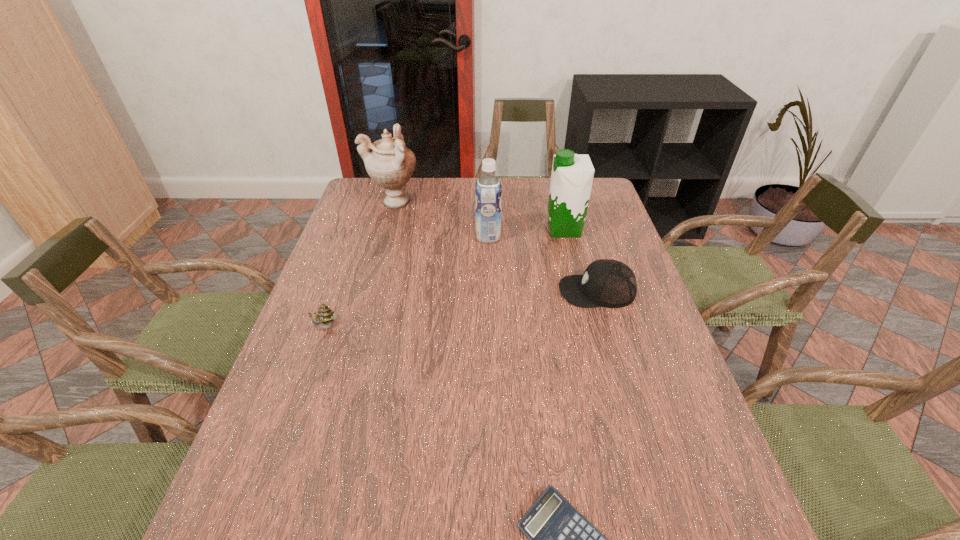
The width and height of the screenshot is (960, 540). What are the coordinates of `urn` in the screenshot? It's located at (390, 164).

Where is `the right soya milk`? This screenshot has width=960, height=540. the right soya milk is located at coordinates (572, 175).

This screenshot has height=540, width=960. I want to click on the left soya milk, so click(x=488, y=189).

Identify the location of the third nearest object. The width and height of the screenshot is (960, 540). (608, 283).

Find the location of a particular element. This screenshot has width=960, height=540. snail is located at coordinates (325, 315).

Where is `vacant space located 0.280m on the right of the urn`? vacant space located 0.280m on the right of the urn is located at coordinates (498, 201).

This screenshot has height=540, width=960. In order to click on vacant space located 0.230m on the front-facing side of the right soya milk in this screenshot , I will do `click(476, 230)`.

Image resolution: width=960 pixels, height=540 pixels. In order to click on blank space located 0.340m on the front-facing side of the right soya milk in this screenshot , I will do click(443, 230).

Find the location of `free spot located on the front-facing side of the right soya milk`. free spot located on the front-facing side of the right soya milk is located at coordinates (513, 230).

Locate an element on the screen. The image size is (960, 540). free space located on the label of the left soya milk is located at coordinates (389, 237).